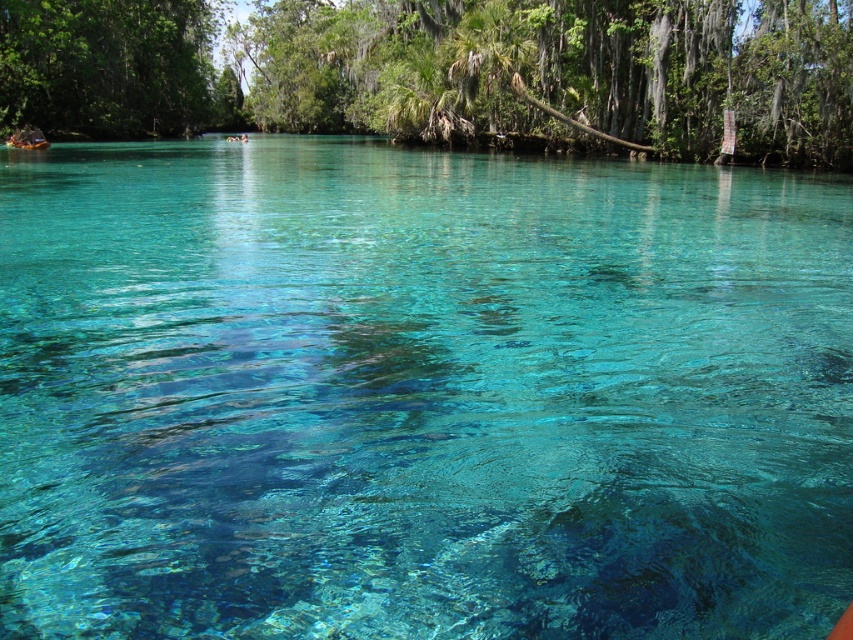
Question: Among these objects, which one is nearest to the camera?

Choices:
 (A) green leafy tree at upper center
 (B) green leafy tree at upper left

Answer: (A)

Question: Which object is farther from the camera taking this photo?

Choices:
 (A) green leafy tree at upper left
 (B) green leafy tree at upper center

Answer: (A)

Question: Observing the image, what is the correct spatial positioning of green leafy tree at upper center in reference to green leafy tree at upper left?

Choices:
 (A) below
 (B) above

Answer: (A)

Question: Can you confirm if green leafy tree at upper center is wider than green leafy tree at upper left?

Choices:
 (A) yes
 (B) no

Answer: (A)

Question: Which point appears closest to the camera in this image?

Choices:
 (A) (33, 29)
 (B) (612, 0)

Answer: (B)

Question: Does green leafy tree at upper center appear under green leafy tree at upper left?

Choices:
 (A) no
 (B) yes

Answer: (B)